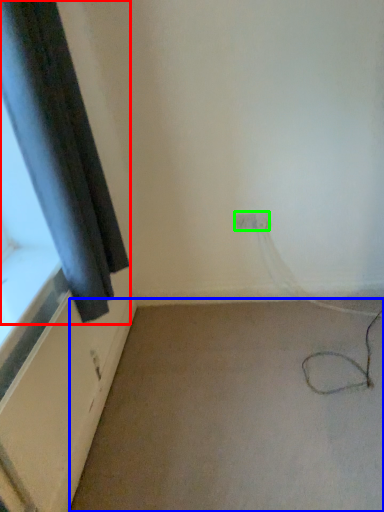
Question: Which object is positioned closest to curtain (highlighted by a red box)? Select from plain (highlighted by a blue box) and electric outlet (highlighted by a green box).

Choices:
 (A) plain
 (B) electric outlet

Answer: (A)